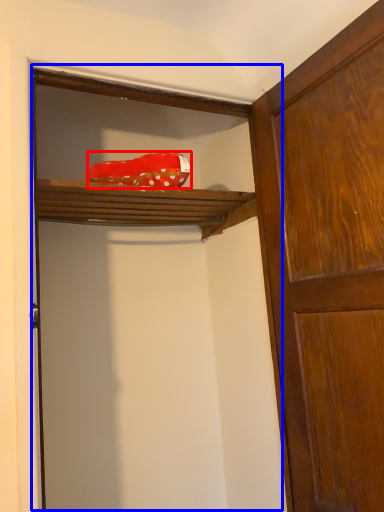
Question: Which object appears closest to the camera in this image, material (highlighted by a red box) or door (highlighted by a blue box)?

Choices:
 (A) material
 (B) door

Answer: (B)